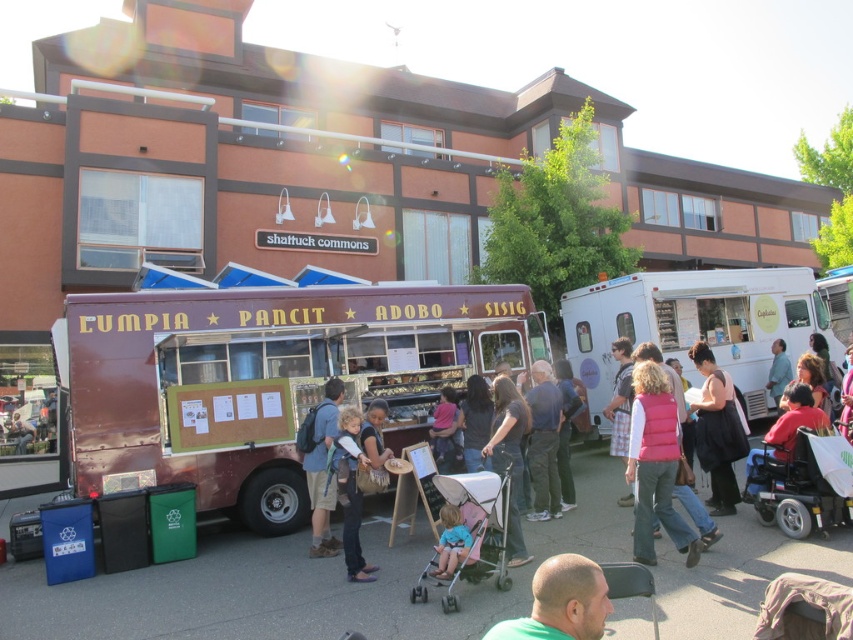
You are a photographer taking a picture of the food truck scene. You notice a person wearing a pink puffer vest at center and denim shorts at center. Which clothing item is higher up on their body?

The pink puffer vest at center is above the denim shorts at center, so the pink puffer vest at center is higher up on their body.

You are a person trying to navigate through the crowd in the scene. You need to reach the white glossy food truck at right but there are people around, specifically the denim pants at center. Which area should you avoid to reach the food truck more easily?

You should avoid the area occupied by the denim pants at center since the white glossy food truck at right occupies less space, meaning the denim pants at center is taking up more space and blocking the path.

You are standing at the point labeled point (86, 484) and want to take a photo of the food truck. If you move towards point (548, 371), will the food truck appear larger or smaller in your camera view?

Moving from point (86, 484) to point (548, 371) takes you farther away from the camera. Since point (86, 484) is closer to the camera than point (548, 371), moving towards the latter will increase your distance from the camera. This means the food truck will appear smaller in your camera view as you move away from the original position.